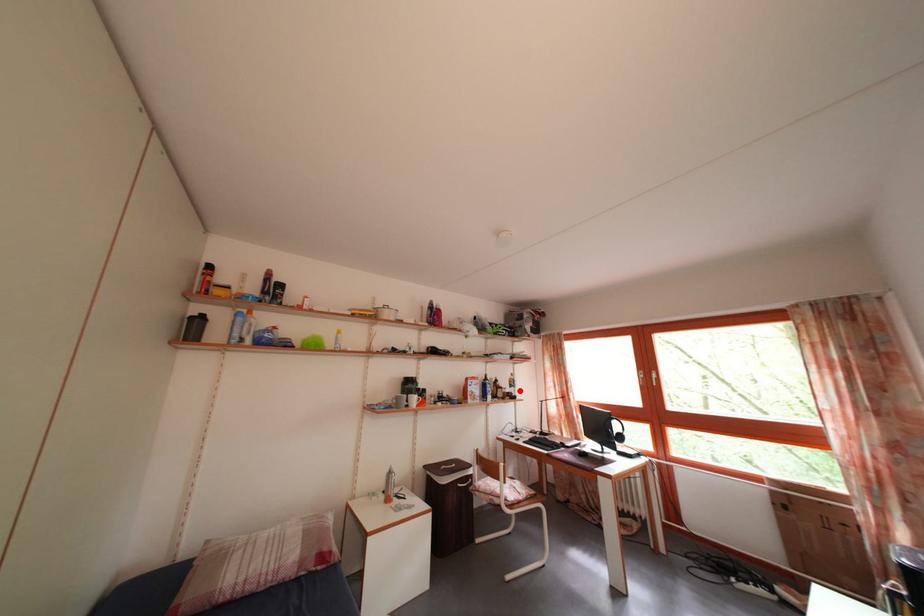
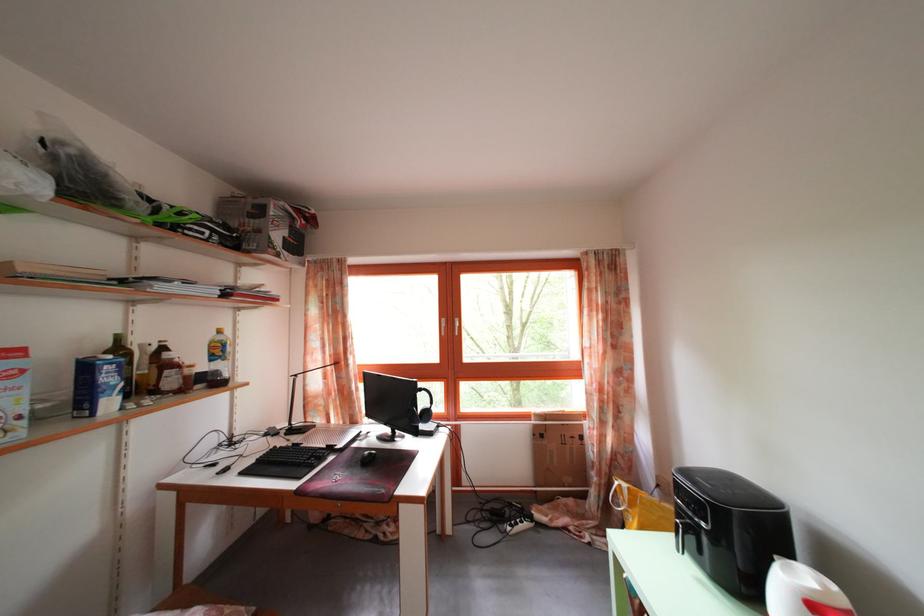
Question: I am providing you with two images of the same scene from different viewpoints. In image1, a red point is highlighted. Considering the same 3D point in image2, which of the following is correct?

Choices:
 (A) It is closer
 (B) It is farther

Answer: (A)